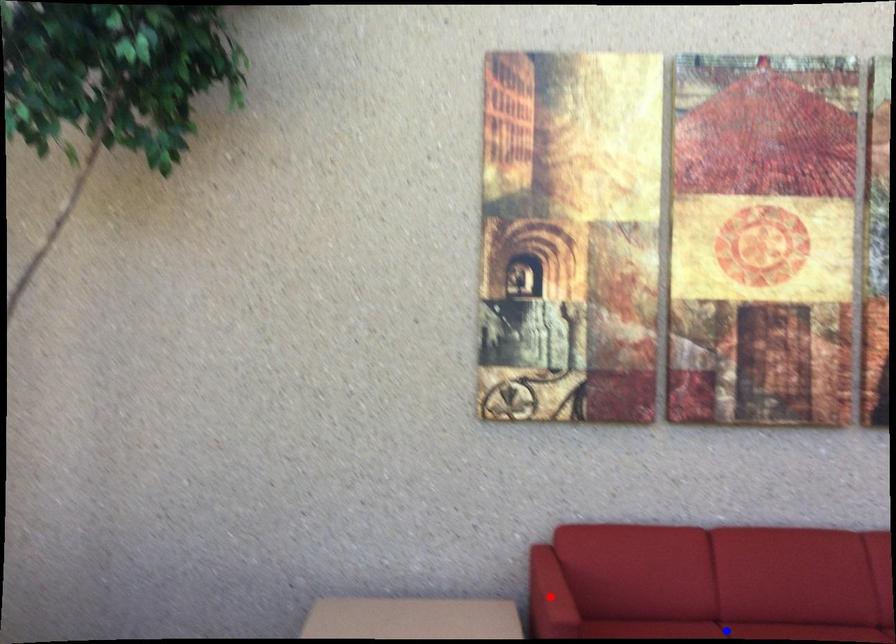
Question: Two points are marked on the image. Which point is closer to the camera?

Choices:
 (A) Blue point is closer.
 (B) Red point is closer.

Answer: (B)